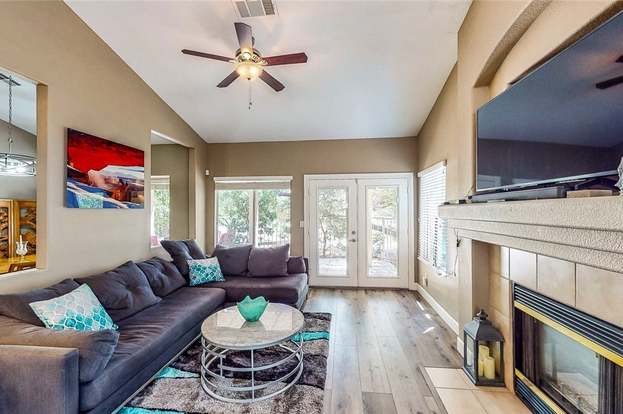
Locate an element on the screen. The image size is (623, 414). hanging light is located at coordinates (12, 163).